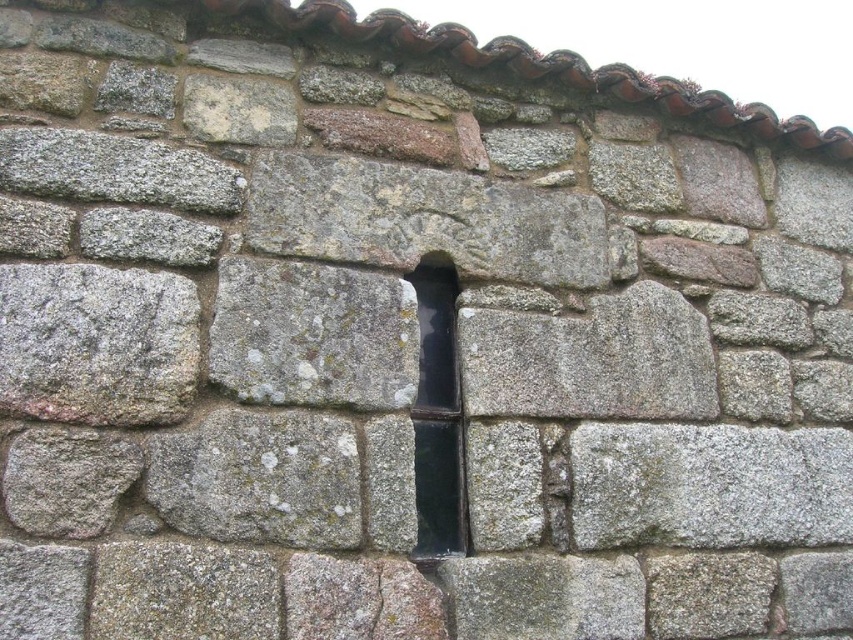
Who is more distant from viewer, (x=447, y=380) or (x=380, y=576)?

The point (x=447, y=380) is more distant.

Can you confirm if black glass window at center is shorter than gray stone crack at center?

In fact, black glass window at center may be taller than gray stone crack at center.

In order to click on black glass window at center in this screenshot , I will do click(x=437, y=416).

You are a GUI agent. You are given a task and a screenshot of the screen. Output one action in this format:
    pyautogui.click(x=<x>, y=<y>)
    Task: Click on the black glass window at center
    
    Given the screenshot: What is the action you would take?
    pyautogui.click(x=437, y=416)